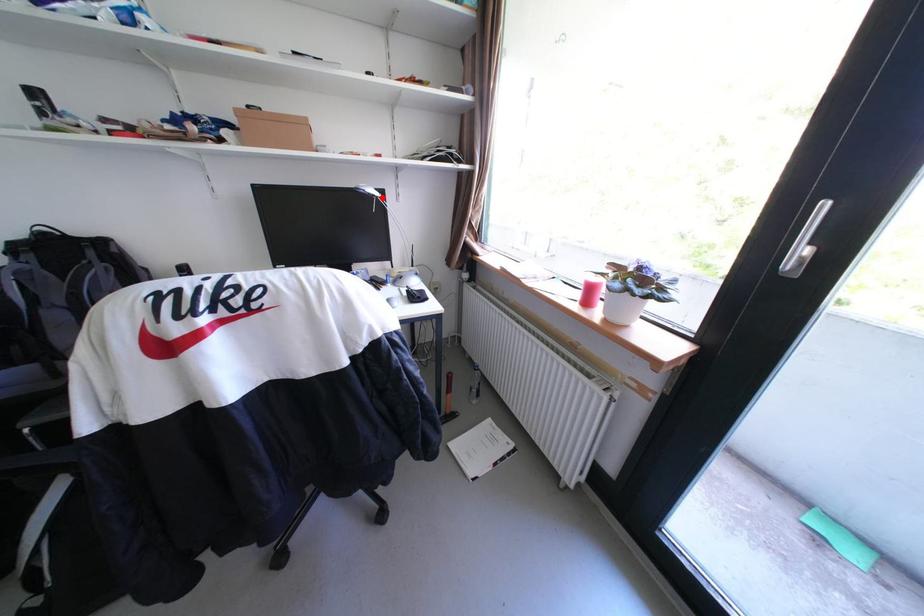
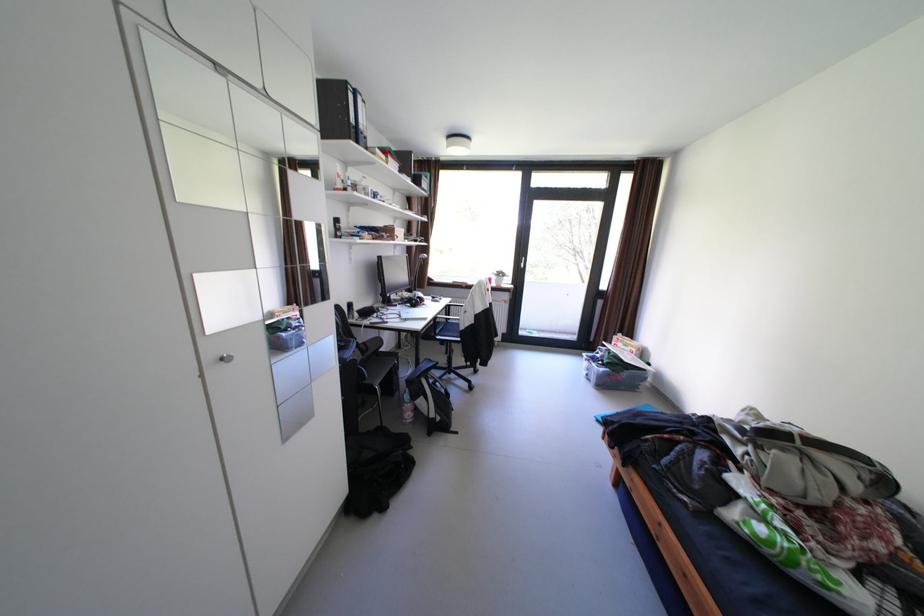
Locate, in the second image, the point that corresponds to the highlighted location in the first image.

(432, 259)